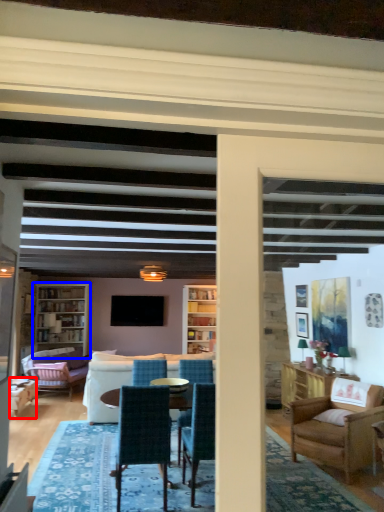
Question: Among these objects, which one is nearest to the camera, chair (highlighted by a red box) or bookcase (highlighted by a blue box)?

Choices:
 (A) chair
 (B) bookcase

Answer: (A)